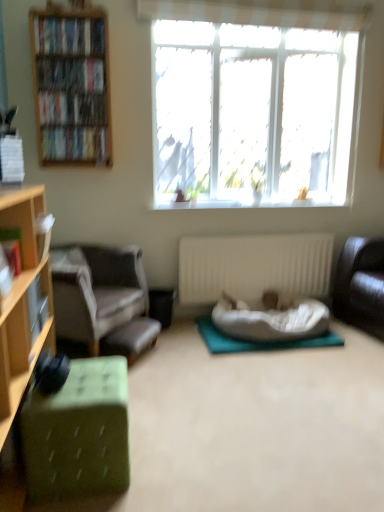
The height and width of the screenshot is (512, 384). I want to click on free space between green fabric ottoman at lower left and teal fabric yoga mat at center, so click(x=209, y=384).